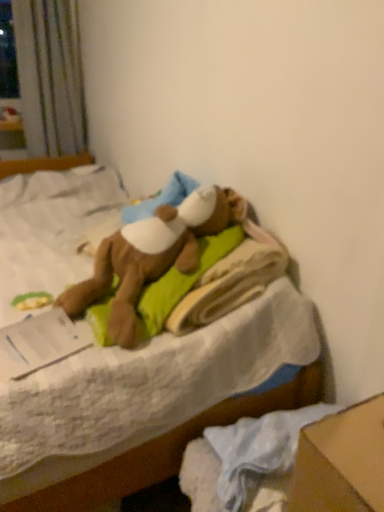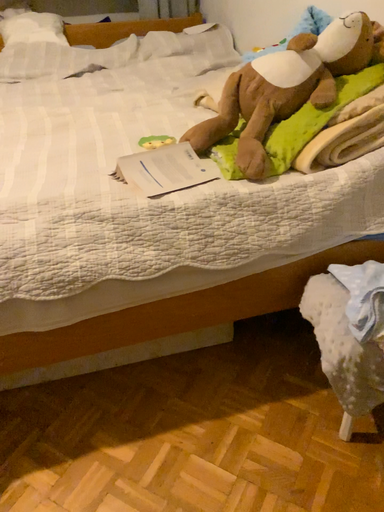
Question: How did the camera likely rotate when shooting the video?

Choices:
 (A) rotated upward
 (B) rotated downward

Answer: (B)